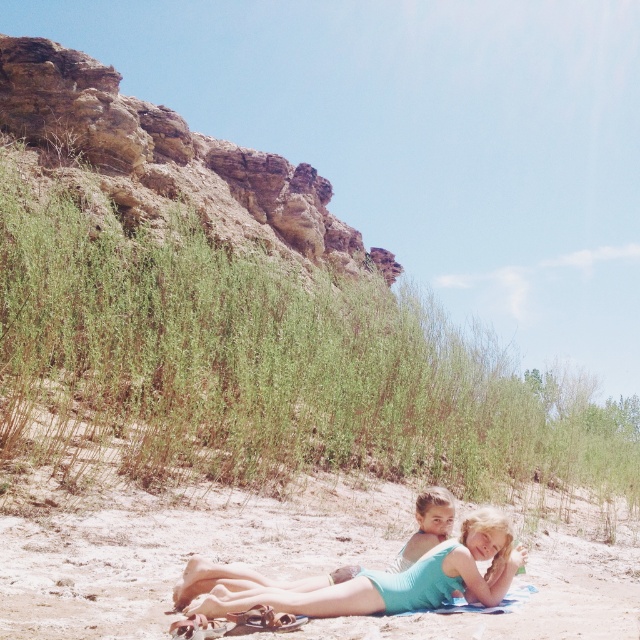
Question: From the image, what is the correct spatial relationship of light blue swimsuit at center in relation to rustic stone cliff at upper left?

Choices:
 (A) left
 (B) right

Answer: (B)

Question: Which object is the farthest from the light blue swimsuit at center?

Choices:
 (A) teal fabric swimsuit at lower center
 (B) rustic stone cliff at upper left

Answer: (B)

Question: Is light blue swimsuit at center behind rustic stone cliff at upper left?

Choices:
 (A) yes
 (B) no

Answer: (B)

Question: Among these objects, which one is farthest from the camera?

Choices:
 (A) teal fabric swimsuit at lower center
 (B) light blue swimsuit at center

Answer: (A)

Question: Based on their relative distances, which object is farther from the rustic stone cliff at upper left?

Choices:
 (A) light blue swimsuit at center
 (B) teal fabric swimsuit at lower center

Answer: (B)

Question: Is light blue swimsuit at center to the left of teal fabric swimsuit at lower center from the viewer's perspective?

Choices:
 (A) no
 (B) yes

Answer: (A)